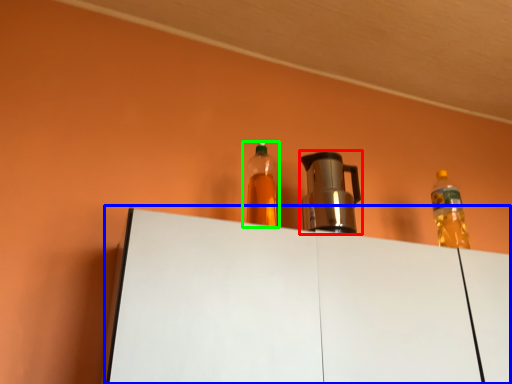
Question: Which object is the farthest from coffeepot (highlighted by a red box)? Choose among these: table (highlighted by a blue box) or bottle (highlighted by a green box).

Choices:
 (A) table
 (B) bottle

Answer: (A)